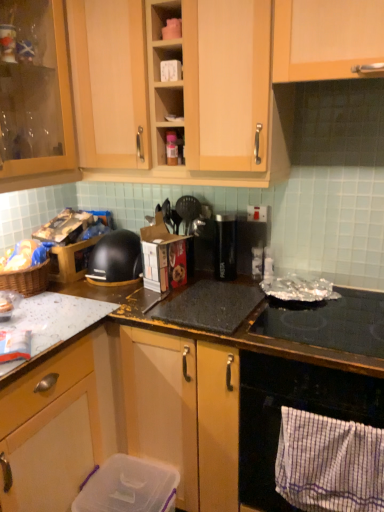
Question: Is black glass oven at lower right facing towards metallic silver cooking utensils at center, which appears as the third appliance when viewed from the right?

Choices:
 (A) yes
 (B) no

Answer: (B)

Question: Is black glass oven at lower right oriented away from metallic silver cooking utensils at center, the 1th appliance viewed from the top?

Choices:
 (A) yes
 (B) no

Answer: (B)

Question: Does black glass oven at lower right lie in front of metallic silver cooking utensils at center, arranged as the 4th appliance when ordered from the bottom?

Choices:
 (A) yes
 (B) no

Answer: (A)

Question: Is black glass oven at lower right smaller than metallic silver cooking utensils at center, the 1th appliance viewed from the top?

Choices:
 (A) no
 (B) yes

Answer: (A)

Question: Is black glass oven at lower right surrounding metallic silver cooking utensils at center, the 1th appliance viewed from the top?

Choices:
 (A) yes
 (B) no

Answer: (B)

Question: Is clear plastic container at lower center, which is counted as the first appliance, starting from the bottom, in front of or behind black glass oven at lower right in the image?

Choices:
 (A) behind
 (B) front

Answer: (A)

Question: Considering the positions of clear plastic container at lower center, the fourth appliance viewed from the right, and black glass oven at lower right in the image, is clear plastic container at lower center, the fourth appliance viewed from the right, bigger or smaller than black glass oven at lower right?

Choices:
 (A) big
 (B) small

Answer: (B)

Question: Is clear plastic container at lower center, the fourth appliance viewed from the right, inside or outside of black glass oven at lower right?

Choices:
 (A) inside
 (B) outside

Answer: (B)

Question: From a real-world perspective, is clear plastic container at lower center, positioned as the first appliance in left-to-right order, physically located above or below black glass oven at lower right?

Choices:
 (A) below
 (B) above

Answer: (A)

Question: Considering their positions, is black granite countertop at center located in front of or behind matte brown chips in basket at left?

Choices:
 (A) behind
 (B) front

Answer: (B)

Question: From a real-world perspective, relative to matte brown chips in basket at left, is black granite countertop at center vertically above or below?

Choices:
 (A) below
 (B) above

Answer: (A)

Question: Is black granite countertop at center spatially inside matte brown chips in basket at left, or outside of it?

Choices:
 (A) outside
 (B) inside

Answer: (A)

Question: From their relative heights in the image, would you say black granite countertop at center is taller or shorter than matte brown chips in basket at left?

Choices:
 (A) short
 (B) tall

Answer: (B)

Question: From the image's perspective, is black glass oven at lower right located above or below matte brown chips in basket at left?

Choices:
 (A) below
 (B) above

Answer: (A)

Question: Looking at the image, does black glass oven at lower right seem bigger or smaller compared to matte brown chips in basket at left?

Choices:
 (A) small
 (B) big

Answer: (B)